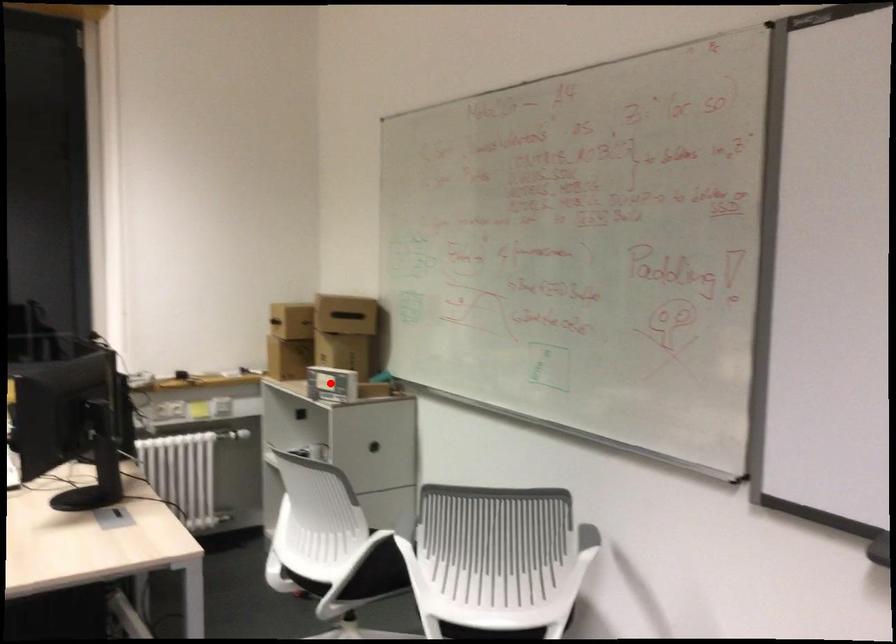
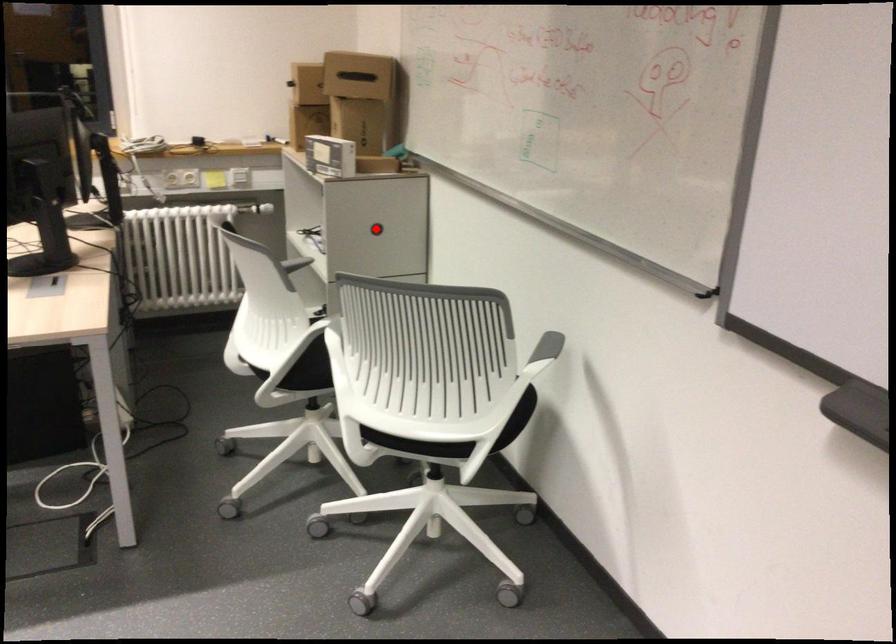
I am providing you with two images of the same scene from different viewpoints. A red point is marked on the first image and another point is marked on the second image. Is the red point in image1 aligned with the point shown in image2?

No